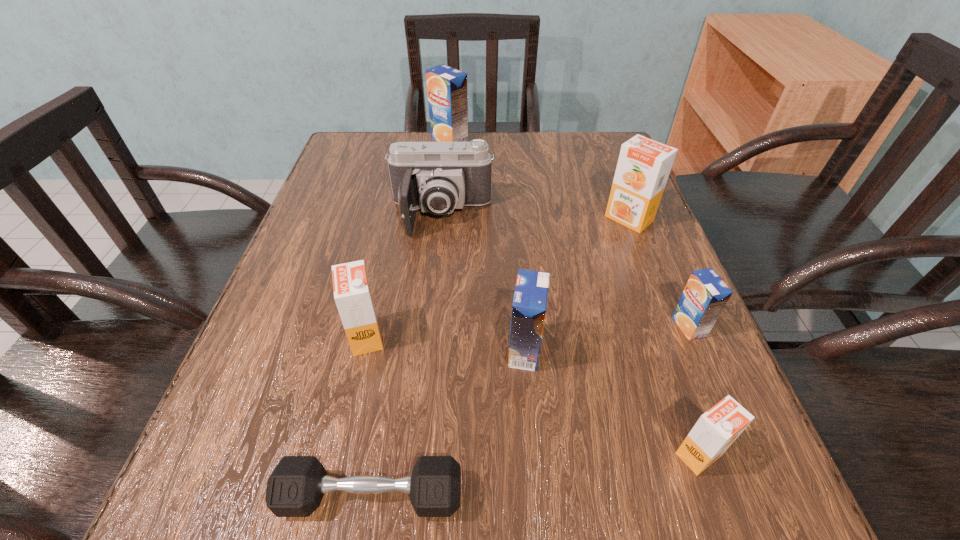
Where is `the nearest orange orange juice`? The image size is (960, 540). the nearest orange orange juice is located at coordinates (715, 431).

The height and width of the screenshot is (540, 960). I want to click on the smallest blue orange_juice, so click(705, 295).

Locate an element on the screen. dumbbell is located at coordinates (295, 488).

Locate an element on the screen. The width and height of the screenshot is (960, 540). vacant space located on the right of the second orange_juice from left to right is located at coordinates (606, 140).

The image size is (960, 540). I want to click on vacant space located 0.150m on the front of the biggest orange orange juice, so click(x=655, y=286).

Locate an element on the screen. free region located at the front of the camera with an open lens cover is located at coordinates (437, 261).

Identify the location of vacant space located 0.140m on the front of the leftmost orange_juice. (342, 443).

The image size is (960, 540). Find the location of `free space located 0.160m on the back of the second blue orange_juice from right to left`. free space located 0.160m on the back of the second blue orange_juice from right to left is located at coordinates (517, 265).

Where is `vacant space situated 0.200m on the left of the smallest orange orange juice`? The height and width of the screenshot is (540, 960). vacant space situated 0.200m on the left of the smallest orange orange juice is located at coordinates (525, 454).

This screenshot has width=960, height=540. Identify the location of free point located on the left of the smallest blue orange_juice. (526, 327).